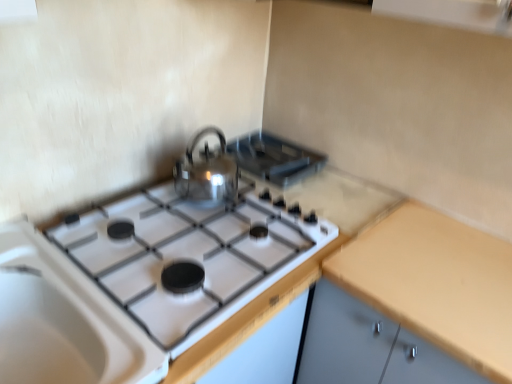
Question: Is yellow matte countertop at right inside shiny metallic kettle at center?

Choices:
 (A) yes
 (B) no

Answer: (B)

Question: Does shiny metallic kettle at center have a smaller size compared to yellow matte countertop at right?

Choices:
 (A) yes
 (B) no

Answer: (A)

Question: Is shiny metallic kettle at center positioned in front of yellow matte countertop at right?

Choices:
 (A) yes
 (B) no

Answer: (B)

Question: Does shiny metallic kettle at center appear on the left side of yellow matte countertop at right?

Choices:
 (A) no
 (B) yes

Answer: (B)

Question: Is shiny metallic kettle at center further to camera compared to yellow matte countertop at right?

Choices:
 (A) no
 (B) yes

Answer: (B)

Question: Choose the correct answer: Is white glossy gas stove at center inside shiny metallic kettle at center or outside it?

Choices:
 (A) inside
 (B) outside

Answer: (B)

Question: Is white glossy gas stove at center taller or shorter than shiny metallic kettle at center?

Choices:
 (A) short
 (B) tall

Answer: (A)

Question: Considering their positions, is white glossy gas stove at center located in front of or behind shiny metallic kettle at center?

Choices:
 (A) front
 (B) behind

Answer: (A)

Question: From the image's perspective, is white glossy gas stove at center above or below shiny metallic kettle at center?

Choices:
 (A) below
 (B) above

Answer: (A)

Question: Is satin silver kettle at upper center spatially inside yellow matte countertop at right, or outside of it?

Choices:
 (A) inside
 (B) outside

Answer: (B)

Question: Considering the positions of point (254, 132) and point (391, 316), is point (254, 132) closer or farther from the camera than point (391, 316)?

Choices:
 (A) farther
 (B) closer

Answer: (A)

Question: From the image's perspective, is satin silver kettle at upper center located above or below yellow matte countertop at right?

Choices:
 (A) above
 (B) below

Answer: (A)

Question: From a real-world perspective, relative to yellow matte countertop at right, is satin silver kettle at upper center vertically above or below?

Choices:
 (A) below
 (B) above

Answer: (B)

Question: Is satin silver kettle at upper center wider or thinner than shiny metallic kettle at center?

Choices:
 (A) thin
 (B) wide

Answer: (B)

Question: Considering the positions of satin silver kettle at upper center and shiny metallic kettle at center in the image, is satin silver kettle at upper center taller or shorter than shiny metallic kettle at center?

Choices:
 (A) short
 (B) tall

Answer: (A)